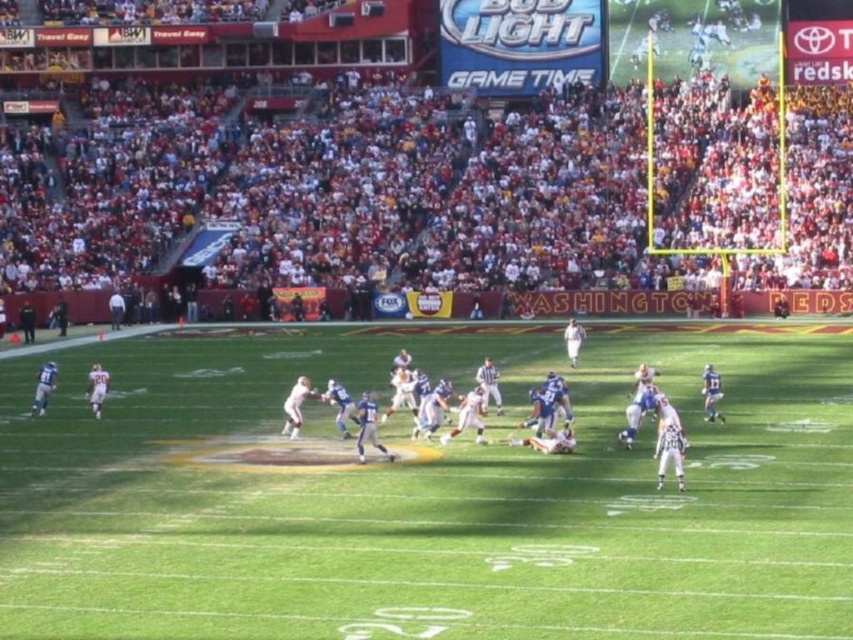
You are a spectator sitting in the stands and want to take a photo of both the point at coordinates (241, 237) and the point at coordinates (654, 392). Based on their positions, which point will appear closer to you in the photo?

Point at coordinates (241, 237) will appear closer to you in the photo because it is further to the viewer than point at coordinates (654, 392).

You are a photographer standing at the center of the stadium, aiming to capture the American football game. You notice two points marked on your camera screen at coordinates point (790, 376) and point (706, 419). Which point is closer to your current position?

Point (706, 419) is closer to your current position because it is less further to the camera than point (790, 376).

From the picture: You are a player on the field during an American football game. You need to pass the ball from point A to point B. Point A is at coordinates point (183, 566) and point B is at coordinates point (190, 134). Based on the field layout, which direction should you throw the ball to ensure it reaches point B from point A?

To throw the ball from point A at coordinates point (183, 566) to point B at coordinates point (190, 134), you should throw it towards the left direction since point A is in front of point B.